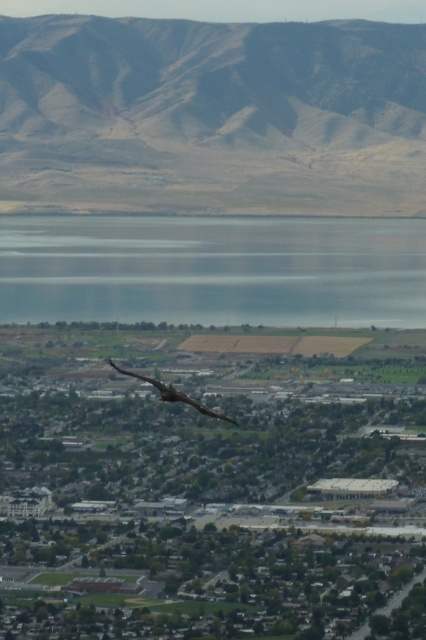
You are standing at the point marked as point (212, 116) in the image. What do you see directly in front of you?

You see a brown dry mountain at upper center directly in front of you.